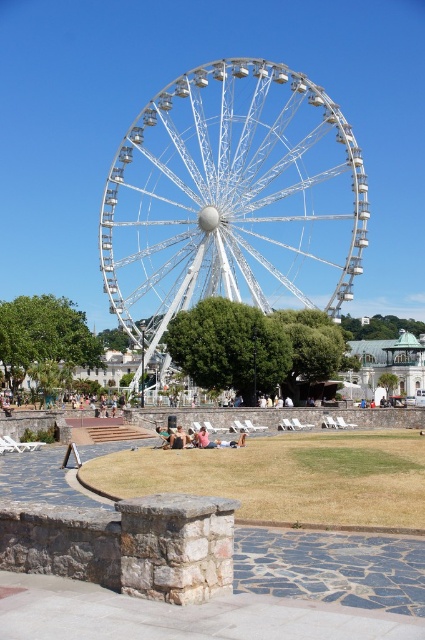
You are standing at the point marked with coordinates point (232,200). What object are you standing on?

You are standing on the white metallic ferris wheel at center.

You are standing at the base of the white metallic ferris wheel at center and want to see the beige fabric people at center lying on the grass. Can you see them clearly from your current position?

The white metallic ferris wheel at center is much taller than the beige fabric people at center, so yes, you can see them clearly from the base of the ferris wheel.